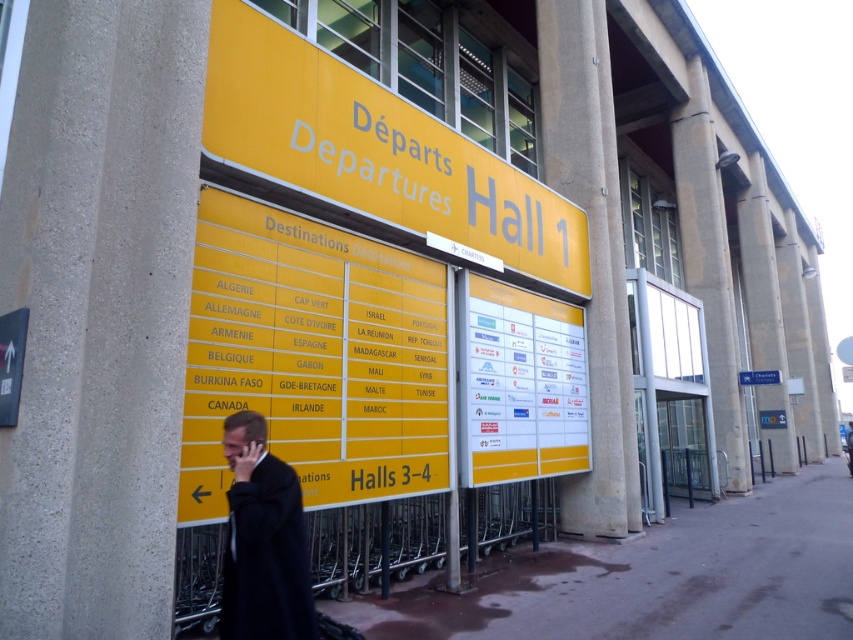
Question: Which of the following is the farthest from the observer?

Choices:
 (A) (396, 198)
 (B) (651, 545)

Answer: (B)

Question: Observing the image, what is the correct spatial positioning of yellow matte signboard at center in reference to dark gray asphalt at lower center?

Choices:
 (A) right
 (B) left

Answer: (B)

Question: Based on their relative distances, which object is farther from the dark gray asphalt at lower center?

Choices:
 (A) yellow matte sign at upper center
 (B) yellow matte signboard at center

Answer: (A)

Question: Which point is closer to the camera?

Choices:
 (A) dark gray asphalt at lower center
 (B) yellow paperboard sign at center
 (C) yellow matte signboard at center

Answer: (C)

Question: Does yellow matte sign at upper center have a lesser width compared to black wool coat at center?

Choices:
 (A) yes
 (B) no

Answer: (B)

Question: Can you confirm if yellow matte sign at upper center is positioned to the left of black wool coat at center?

Choices:
 (A) yes
 (B) no

Answer: (B)